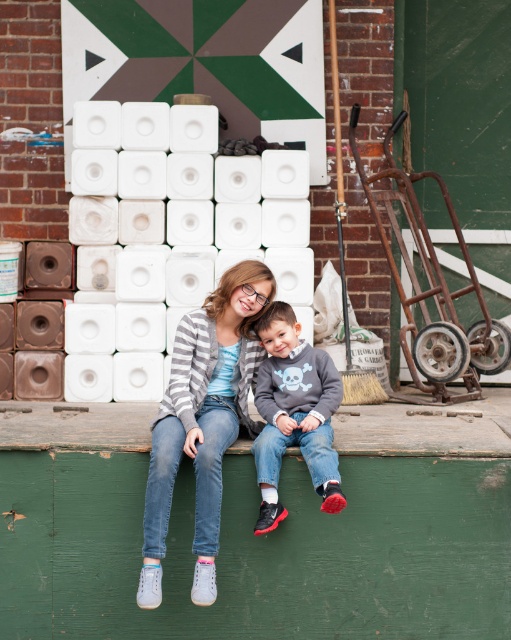
Question: Estimate the real-world distances between objects in this image. Which object is farther from the white plastic toilet paper at center?

Choices:
 (A) green wooden bench at lower center
 (B) dark gray sweater at center
 (C) matte gray sweater at center

Answer: (A)

Question: Which point appears farthest from the camera in this image?

Choices:
 (A) (504, 390)
 (B) (328, 484)
 (C) (195, 184)
 (D) (220, 451)

Answer: (A)

Question: In this image, where is matte gray sweater at center located relative to dark gray sweater at center?

Choices:
 (A) right
 (B) left

Answer: (B)

Question: Does white plastic toilet paper at center have a larger size compared to green wooden bench at lower center?

Choices:
 (A) no
 (B) yes

Answer: (B)

Question: Is green wooden bench at lower center wider than dark gray sweater at center?

Choices:
 (A) no
 (B) yes

Answer: (B)

Question: Which object is closer to the camera taking this photo?

Choices:
 (A) green wooden bench at lower center
 (B) dark gray sweater at center

Answer: (B)